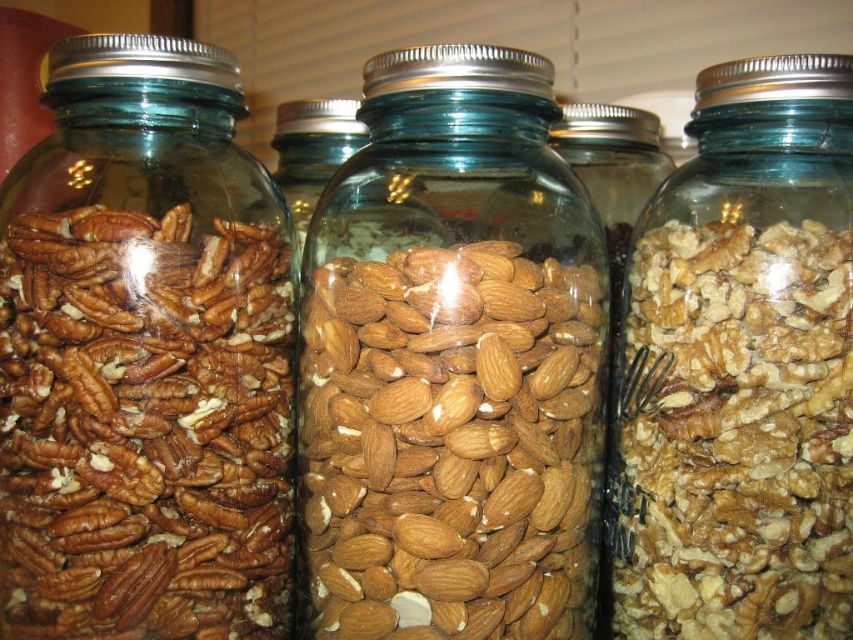
Between translucent glass jar at center and brown textured nuts at center, which one is positioned lower?

brown textured nuts at center is lower down.

Is translucent glass jar at center bigger than brown textured nuts at center?

Correct, translucent glass jar at center is larger in size than brown textured nuts at center.

The image size is (853, 640). What do you see at coordinates (451, 362) in the screenshot?
I see `translucent glass jar at center` at bounding box center [451, 362].

At what (x,y) coordinates should I click in order to perform the action: click on translucent glass jar at center. Please return your answer as a coordinate pair (x, y). The width and height of the screenshot is (853, 640). Looking at the image, I should click on (451, 362).

Is brown matte pecans at left wider than brown textured nuts at center?

Correct, the width of brown matte pecans at left exceeds that of brown textured nuts at center.

Does brown matte pecans at left have a larger size compared to brown textured nuts at center?

Yes, brown matte pecans at left is bigger than brown textured nuts at center.

I want to click on brown matte pecans at left, so click(x=144, y=356).

Does brown matte pecans at left have a lesser height compared to translucent glass jar at center?

No, brown matte pecans at left is not shorter than translucent glass jar at center.

Is brown matte pecans at left to the right of translucent glass jar at center from the viewer's perspective?

In fact, brown matte pecans at left is to the left of translucent glass jar at center.

I want to click on brown matte pecans at left, so click(x=144, y=356).